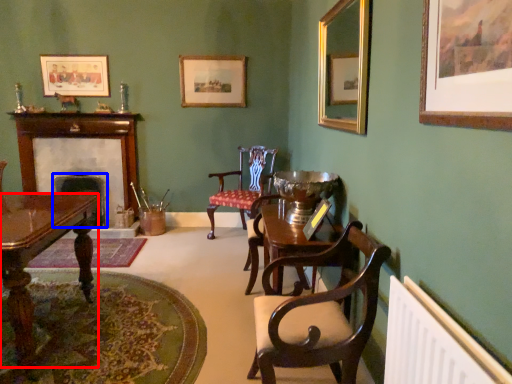
Question: Among these objects, which one is farthest to the camera, desk (highlighted by a red box) or fireplace (highlighted by a blue box)?

Choices:
 (A) desk
 (B) fireplace

Answer: (B)